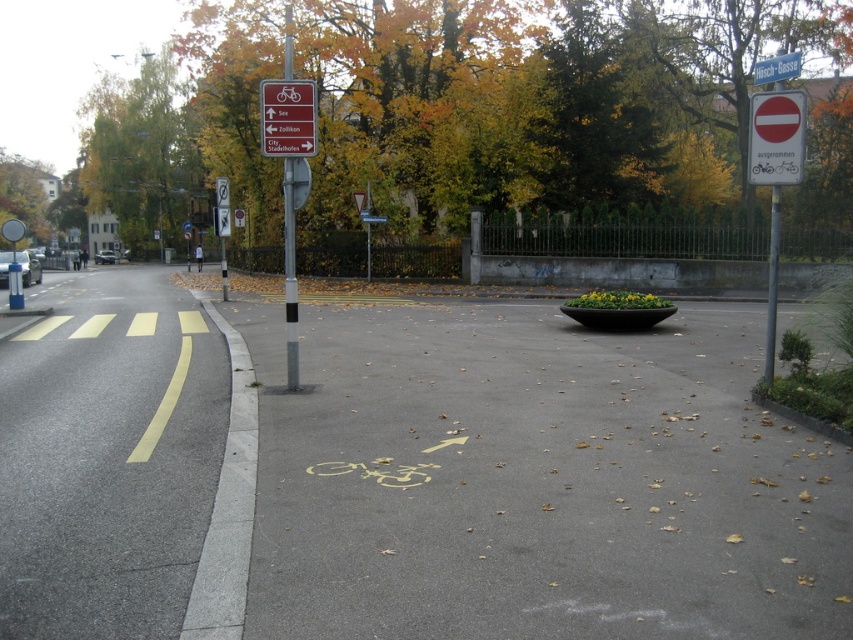
You are a cyclist planning to ride along the yellow painted bicycle lane at lower center. There is also a yellow painted bicycle at lower center in the image. Which one is closer to the ground?

The yellow painted bicycle at lower center is closer to the ground since it is positioned below the yellow painted bicycle lane at lower center.

You are a cyclist approaching the yellow painted bicycle lane at lower center and the metal pole at center. Which object is closer to the ground?

The yellow painted bicycle lane at lower center is closer to the ground because it is below the metal pole at center.